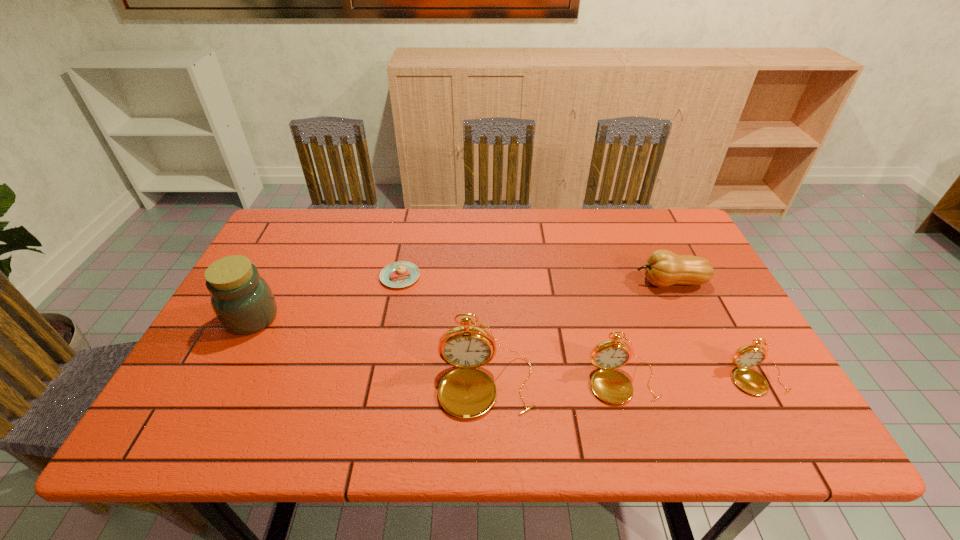
Identify the location of free region located on the front of the fifth object from right to left. (391, 323).

Locate an element on the screen. The image size is (960, 540). vacant space situated 0.360m on the stem side of the gourd is located at coordinates (504, 282).

What are the coordinates of `vacant space positioned on the stem side of the gourd` in the screenshot? It's located at (569, 282).

The height and width of the screenshot is (540, 960). In order to click on blank space located 0.230m on the stem side of the gourd in this screenshot , I will do `click(551, 282)`.

This screenshot has height=540, width=960. I want to click on blank area located 0.050m on the back of the jar, so click(x=269, y=287).

What are the coordinates of `object at the left edge` in the screenshot? It's located at (242, 300).

Where is `pocket watch that is at the right edge`? This screenshot has width=960, height=540. pocket watch that is at the right edge is located at coordinates (749, 380).

Where is `gourd that is at the right edge`? gourd that is at the right edge is located at coordinates (663, 268).

The image size is (960, 540). I want to click on object positioned at the near right corner, so 749,380.

You are a GUI agent. You are given a task and a screenshot of the screen. Output one action in this format:
    pyautogui.click(x=<x>, y=<y>)
    Task: Click on the vacant space at the far edge
    The width and height of the screenshot is (960, 540).
    Given the screenshot: What is the action you would take?
    pyautogui.click(x=588, y=216)